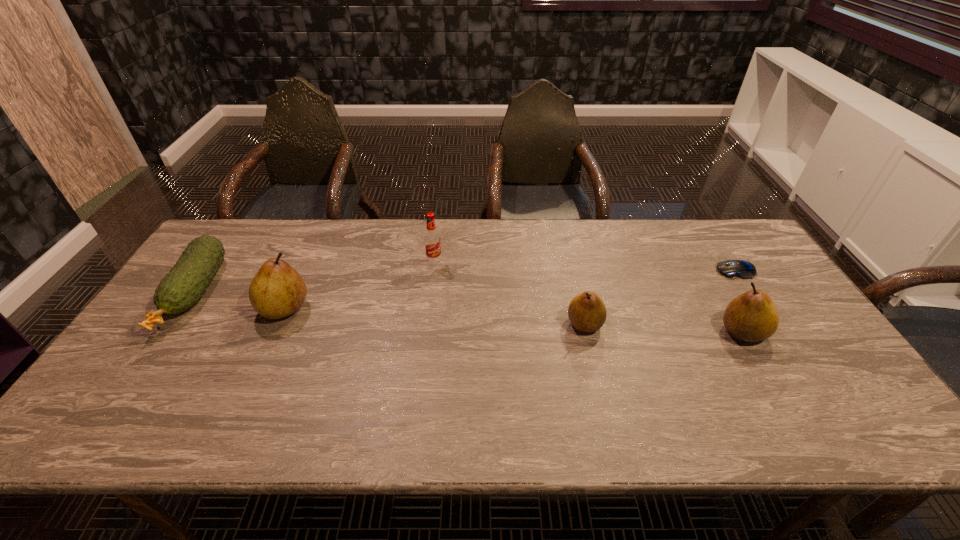
Locate an element on the screen. the leftmost pear is located at coordinates tap(277, 290).

Where is `the third object from right to left`? the third object from right to left is located at coordinates (587, 312).

The height and width of the screenshot is (540, 960). In order to click on the shortest pear in this screenshot , I will do `click(587, 312)`.

This screenshot has width=960, height=540. Identify the location of the rightmost pear. (752, 316).

At what (x,y) coordinates should I click in order to perform the action: click on computer mouse. Please return your answer as a coordinate pair (x, y). The height and width of the screenshot is (540, 960). Looking at the image, I should click on (742, 269).

Locate an element on the screen. Image resolution: width=960 pixels, height=540 pixels. the third object from left to right is located at coordinates (432, 242).

The height and width of the screenshot is (540, 960). What are the coordinates of `the fifth tallest object` in the screenshot? It's located at (182, 287).

The image size is (960, 540). Find the location of `the leftmost object`. the leftmost object is located at coordinates (182, 287).

This screenshot has width=960, height=540. I want to click on free space located on the left of the fifth object from right to left, so click(x=199, y=308).

The width and height of the screenshot is (960, 540). I want to click on free spot located on the left of the second pear from right to left, so click(548, 323).